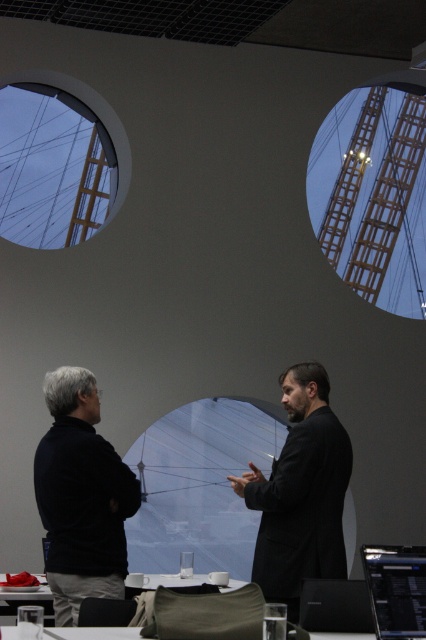
Question: Which of the following is the closest to the observer?

Choices:
 (A) translucent plastic table at center
 (B) black glossy laptop at center
 (C) black matte jacket at left
 (D) black matte laptop at center

Answer: (B)

Question: Observing the image, what is the correct spatial positioning of black matte suit at center in reference to black glossy laptop at center?

Choices:
 (A) above
 (B) below

Answer: (A)

Question: Which point is farther to the camera?

Choices:
 (A) black matte suit at center
 (B) black glossy laptop at center

Answer: (A)

Question: Is black matte jacket at left positioned behind black glossy laptop at center?

Choices:
 (A) no
 (B) yes

Answer: (B)

Question: Which object appears farthest from the camera in this image?

Choices:
 (A) translucent plastic table at center
 (B) black matte jacket at left
 (C) black glossy laptop at center
 (D) black matte suit at center

Answer: (B)

Question: Does black glossy laptop at center appear over translucent plastic table at center?

Choices:
 (A) no
 (B) yes

Answer: (B)